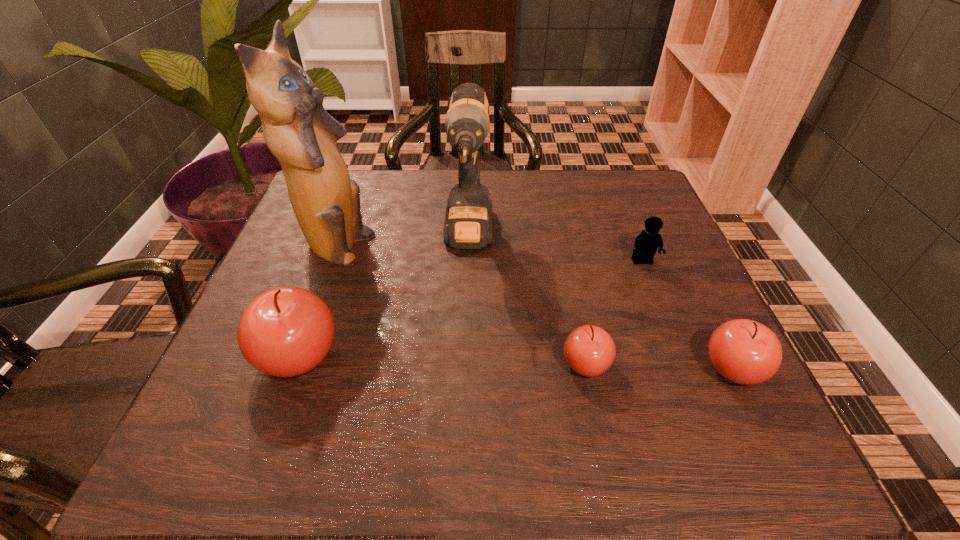
In order to click on object present at the near left corner in this screenshot , I will do `click(287, 331)`.

Find the location of a particular element. This screenshot has height=540, width=960. object that is at the near right corner is located at coordinates (743, 351).

Where is `free space at the far edge of the desktop`? The image size is (960, 540). free space at the far edge of the desktop is located at coordinates (417, 178).

What are the coordinates of `free space at the near edge` in the screenshot? It's located at (430, 371).

You are a GUI agent. You are given a task and a screenshot of the screen. Output one action in this format:
    pyautogui.click(x=<x>, y=<y>)
    Task: Click on the vacant space at the left edge
    This screenshot has width=960, height=540.
    Given the screenshot: What is the action you would take?
    pyautogui.click(x=300, y=239)

The height and width of the screenshot is (540, 960). In the image, there is a desktop. Find the location of `vacant space at the right edge`. vacant space at the right edge is located at coordinates (640, 294).

Where is `free location at the far right corner of the desktop`? free location at the far right corner of the desktop is located at coordinates (607, 171).

Where is `free space between the second tallest apple and the third object from left to right`? The image size is (960, 540). free space between the second tallest apple and the third object from left to right is located at coordinates (601, 303).

Locate an element on the screen. free space between the fourth shortest object and the shortest apple is located at coordinates (443, 360).

Where is `free space that is in between the rightmost apple and the shortest object`? free space that is in between the rightmost apple and the shortest object is located at coordinates (660, 366).